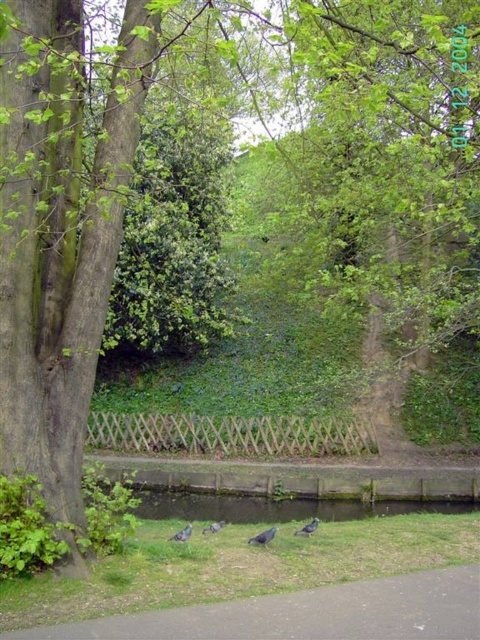
Question: Can you confirm if brown asphalt path at lower center is smaller than gray matte bird at lower center?

Choices:
 (A) yes
 (B) no

Answer: (A)

Question: Which object is positioned farthest from the gray matte bird at lower center?

Choices:
 (A) gray matte bird at center
 (B) purple iridescent bird at center
 (C) green concrete water at lower center

Answer: (C)

Question: Among these points, which one is nearest to the camera?

Choices:
 (A) (222, 522)
 (B) (187, 531)
 (C) (240, 500)
 (D) (323, 611)

Answer: (D)

Question: Which object appears closest to the camera in this image?

Choices:
 (A) purple iridescent bird at center
 (B) brown asphalt path at lower center
 (C) gray matte bird at lower left
 (D) gray matte bird at lower center

Answer: (B)

Question: Does brown asphalt path at lower center have a larger size compared to green concrete water at lower center?

Choices:
 (A) no
 (B) yes

Answer: (B)

Question: Can you confirm if brown asphalt path at lower center is positioned to the left of purple iridescent bird at center?

Choices:
 (A) no
 (B) yes

Answer: (A)